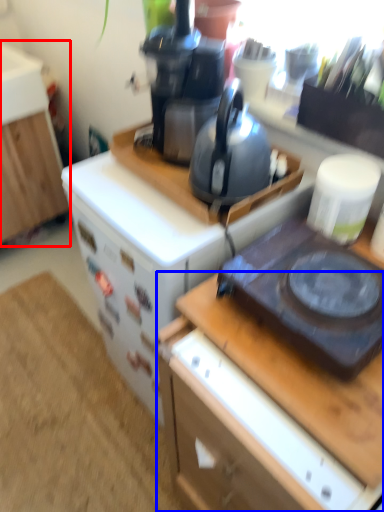
Question: Which object appears farthest to the camera in this image, cabinetry (highlighted by a red box) or desk (highlighted by a blue box)?

Choices:
 (A) cabinetry
 (B) desk

Answer: (A)